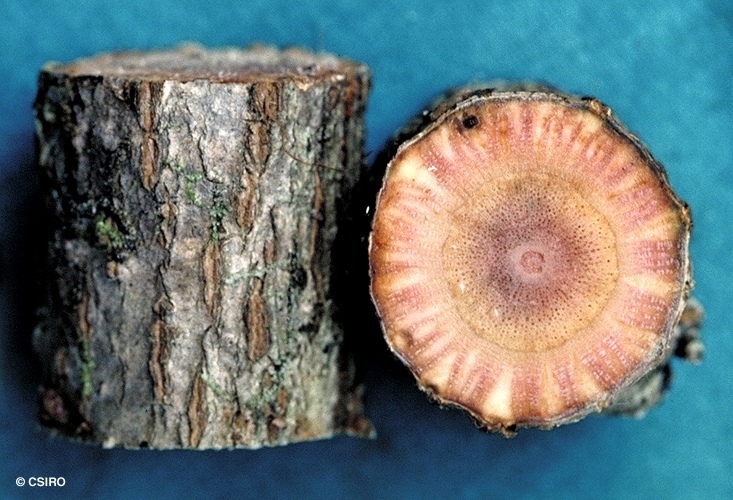
Locate an element on the screen. Image resolution: width=733 pixels, height=500 pixels. dark spot on the wood is located at coordinates (471, 124).